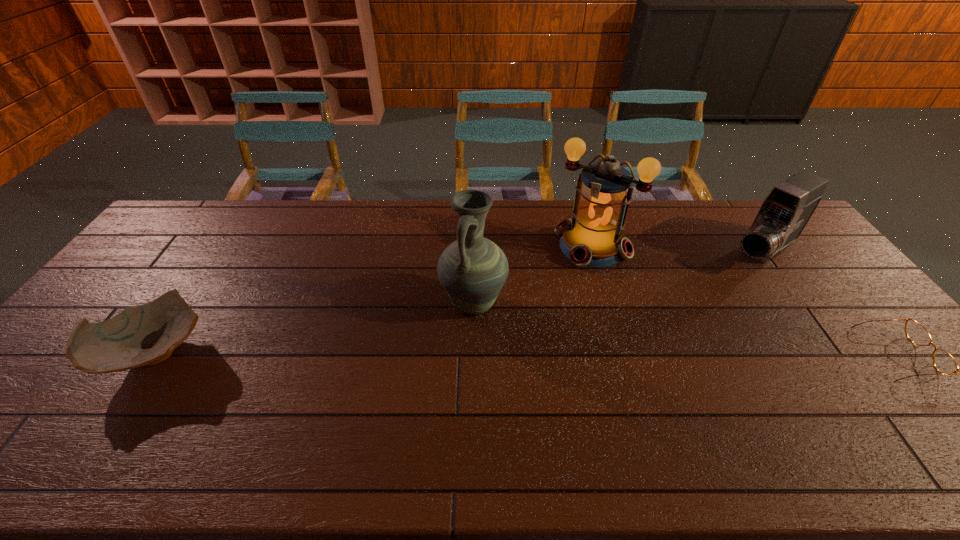
This screenshot has height=540, width=960. In order to click on vacant space on the desktop that is between the leftmost object and the spectacles and is positioned on the front-facing side of the lantern in this screenshot , I will do `click(511, 353)`.

In order to click on free space on the desktop that is between the pottery and the spectacles and is positioned at the front of the third shortest object, highlighting the lens in this screenshot , I will do `click(622, 354)`.

Where is `free space on the desktop that is between the fourth tallest object and the shortest object and is positioned on the handle side of the pitcher`? This screenshot has height=540, width=960. free space on the desktop that is between the fourth tallest object and the shortest object and is positioned on the handle side of the pitcher is located at coordinates (417, 353).